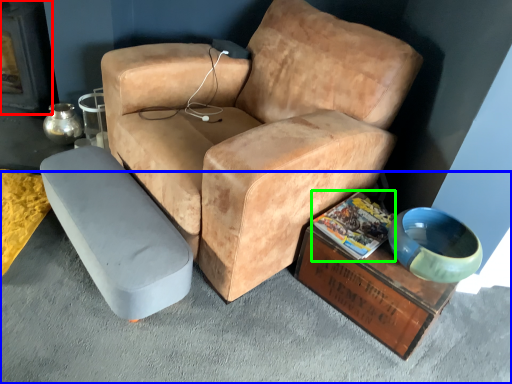
Question: Which object is the farthest from fireplace (highlighted by a red box)? Choose among these: concrete (highlighted by a blue box) or magazine (highlighted by a green box).

Choices:
 (A) concrete
 (B) magazine

Answer: (B)